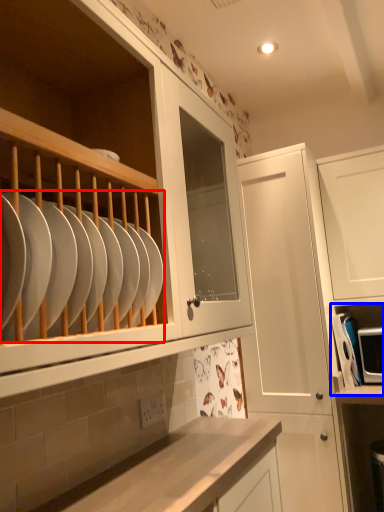
Question: Which of the following is the farthest to the observer, tableware (highlighted by a red box) or shelf (highlighted by a blue box)?

Choices:
 (A) tableware
 (B) shelf

Answer: (B)